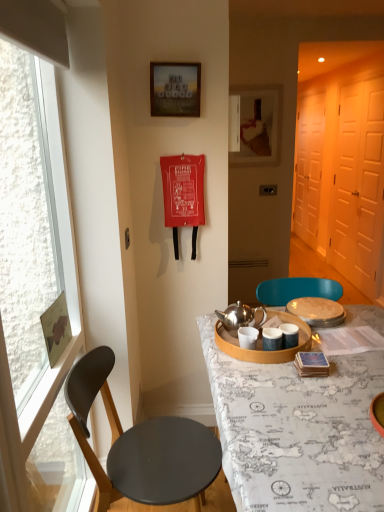
This screenshot has height=512, width=384. In order to click on vacant space behind white matte coffee cup at center in this screenshot , I will do `click(237, 328)`.